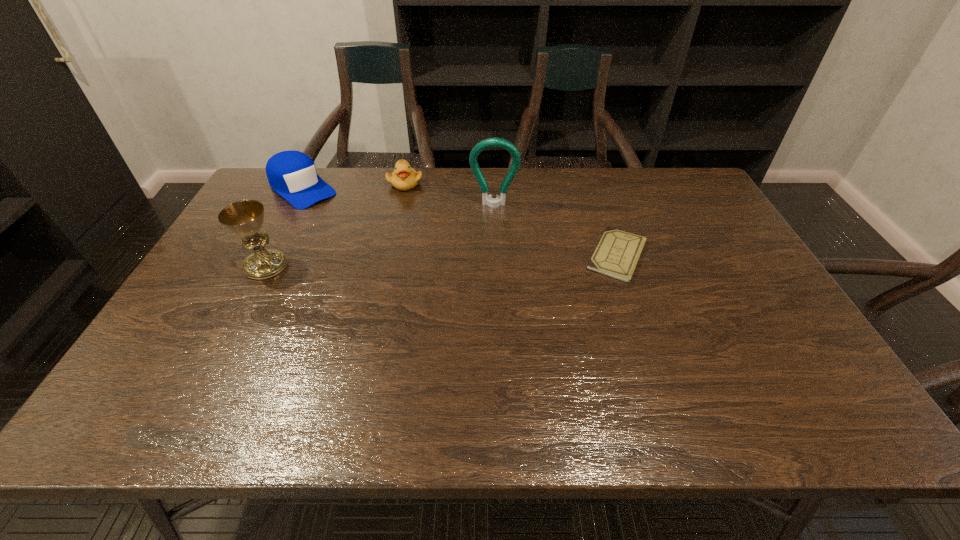
Find the location of a particular element. This screenshot has width=960, height=540. the third closest object to the second tallest object is located at coordinates (487, 199).

You are a GUI agent. You are given a task and a screenshot of the screen. Output one action in this format:
    pyautogui.click(x=<x>, y=<y>)
    Task: Click on the object identified as the second closest to the tallest object
    Image resolution: width=960 pixels, height=540 pixels.
    Given the screenshot: What is the action you would take?
    pyautogui.click(x=617, y=253)

Locate an element on the screen. vacant point that satisfies the following two spatial constraints: 1. on the front side of the fourth object from left to right; 2. on the left side of the checkbook is located at coordinates (495, 255).